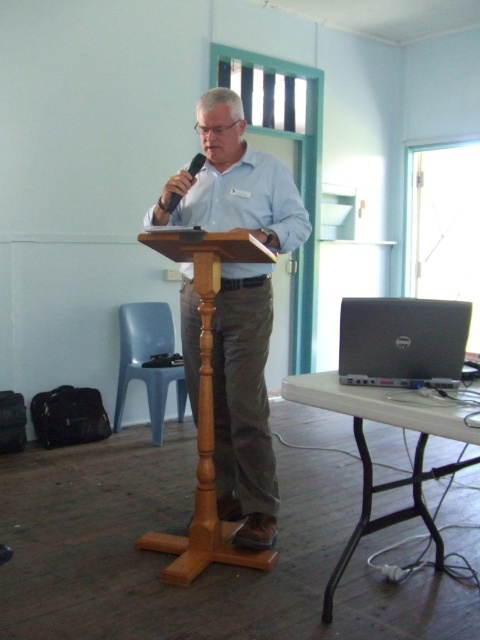
You are an event organizer who needs to adjust the setup for a presentation. The speaker is using the black matte microphone at center, and there is a dell laptop at right. Where should you place the laptop to ensure it is within easy reach of the speaker while keeping it visible to the audience?

The dell laptop at right should be moved to the left side of the black matte microphone at center so it is closer to the speaker and still visible to the audience since the dell laptop at right is currently positioned to the right of the black matte microphone at center.